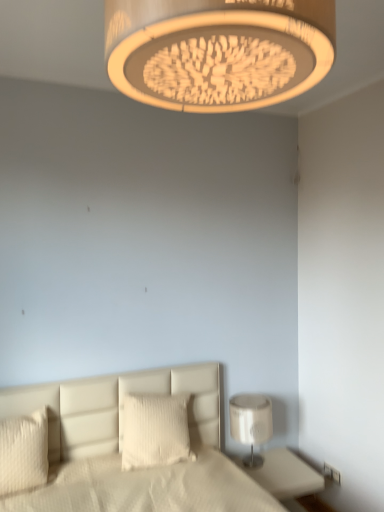
Question: Is the depth of white glossy nightstand at lower right less than that of white glossy lamp at lower right, the first lamp from the back?

Choices:
 (A) yes
 (B) no

Answer: (A)

Question: Does white glossy nightstand at lower right have a smaller size compared to white glossy lamp at lower right, the first lamp from the back?

Choices:
 (A) yes
 (B) no

Answer: (B)

Question: Does white glossy nightstand at lower right have a lesser height compared to white glossy lamp at lower right, the 1th lamp positioned from the right?

Choices:
 (A) yes
 (B) no

Answer: (A)

Question: Can you confirm if white glossy nightstand at lower right is positioned to the left of white glossy lamp at lower right, the first lamp from the back?

Choices:
 (A) no
 (B) yes

Answer: (A)

Question: Is white glossy nightstand at lower right directly adjacent to white glossy lamp at lower right, arranged as the 2th lamp when viewed from the front?

Choices:
 (A) no
 (B) yes

Answer: (A)

Question: From the image's perspective, relative to white textured pillow at center, the 1th pillow in the right-to-left sequence, is white leather bed at lower center above or below?

Choices:
 (A) below
 (B) above

Answer: (A)

Question: In terms of width, does white leather bed at lower center look wider or thinner when compared to white textured pillow at center, marked as the second pillow in a left-to-right arrangement?

Choices:
 (A) wide
 (B) thin

Answer: (A)

Question: Choose the correct answer: Is white leather bed at lower center inside white textured pillow at center, which is the 1th pillow from back to front, or outside it?

Choices:
 (A) outside
 (B) inside

Answer: (A)

Question: Considering the positions of point click(x=1, y=510) and point click(x=132, y=454), is point click(x=1, y=510) closer or farther from the camera than point click(x=132, y=454)?

Choices:
 (A) farther
 (B) closer

Answer: (B)

Question: From their relative heights in the image, would you say white plastic electric outlet at lower right is taller or shorter than matte beige lampshade at upper center, placed as the 1th lamp when sorted from top to bottom?

Choices:
 (A) tall
 (B) short

Answer: (B)

Question: Would you say white plastic electric outlet at lower right is to the left or to the right of matte beige lampshade at upper center, the second lamp in the right-to-left sequence, in the picture?

Choices:
 (A) right
 (B) left

Answer: (A)

Question: Looking at their shapes, would you say white plastic electric outlet at lower right is wider or thinner than matte beige lampshade at upper center, the first lamp in the left-to-right sequence?

Choices:
 (A) wide
 (B) thin

Answer: (B)

Question: From a real-world perspective, is white plastic electric outlet at lower right physically located above or below matte beige lampshade at upper center, marked as the second lamp in a bottom-to-top arrangement?

Choices:
 (A) above
 (B) below

Answer: (B)

Question: In the image, is white leather bed at lower center on the left side or the right side of white glossy lamp at lower right, the 1th lamp positioned from the right?

Choices:
 (A) left
 (B) right

Answer: (A)

Question: Is white leather bed at lower center bigger or smaller than white glossy lamp at lower right, the second lamp when ordered from top to bottom?

Choices:
 (A) big
 (B) small

Answer: (A)